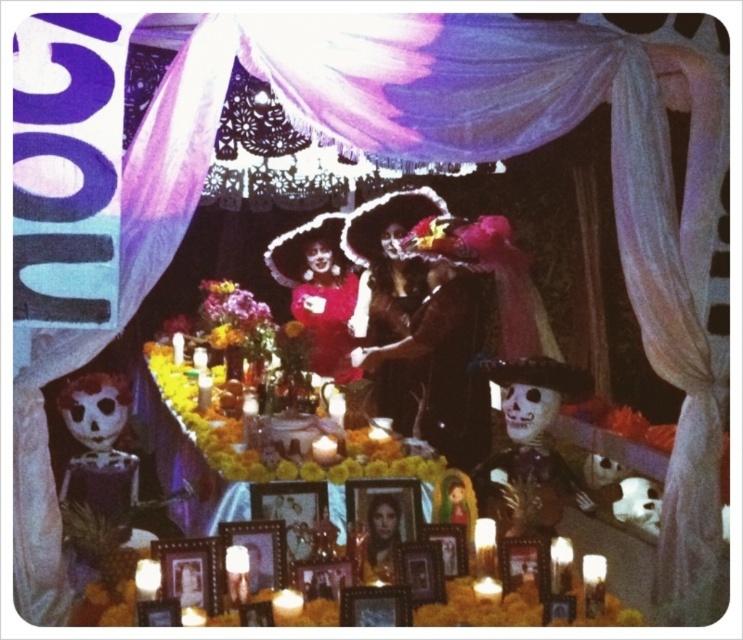
You are organizing a DIA DE LOS MUERTOS altar and need to place the pink satin dress at center and vibrant floral bouquet at center on the table. Which object takes up more space horizontally?

The vibrant floral bouquet at center takes up more space horizontally than the pink satin dress at center because the pink satin dress at center has a lesser width compared to vibrant floral bouquet at center.

You are standing in front of a traditional Day of the Dead altar. You see a pink satin dress at center and a vibrant floral bouquet at center. Which object is positioned to the right of the other?

The pink satin dress at center is to the right of the vibrant floral bouquet at center.

You are standing in front of a traditional DIA DE LOS MUERTOS altar. You see a matte black dress at center and a white painted skull at center. Which object is closer to you?

The matte black dress at center is closer to you because the white painted skull at center is behind it.